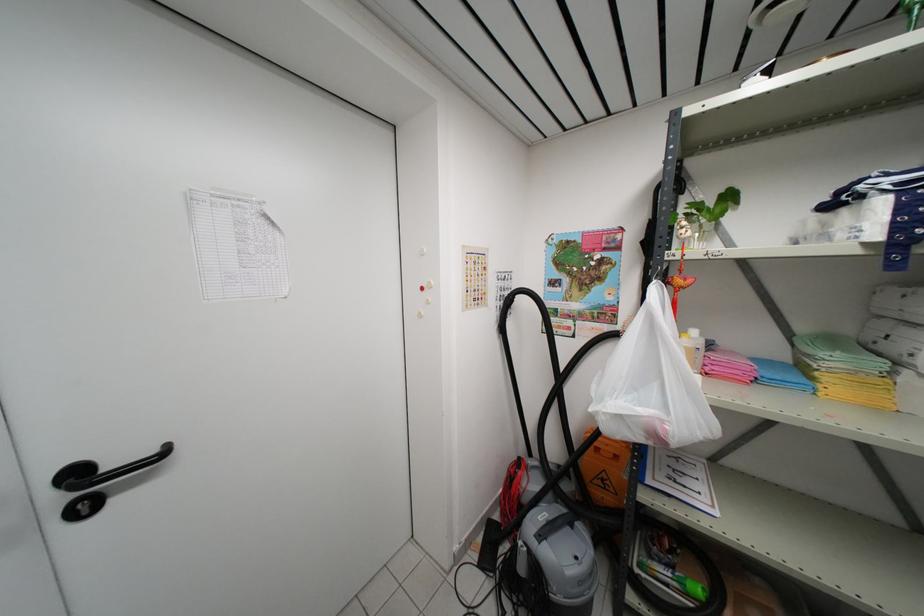
Locate an element on the screen. The image size is (924, 616). red circular magnet is located at coordinates (422, 286).